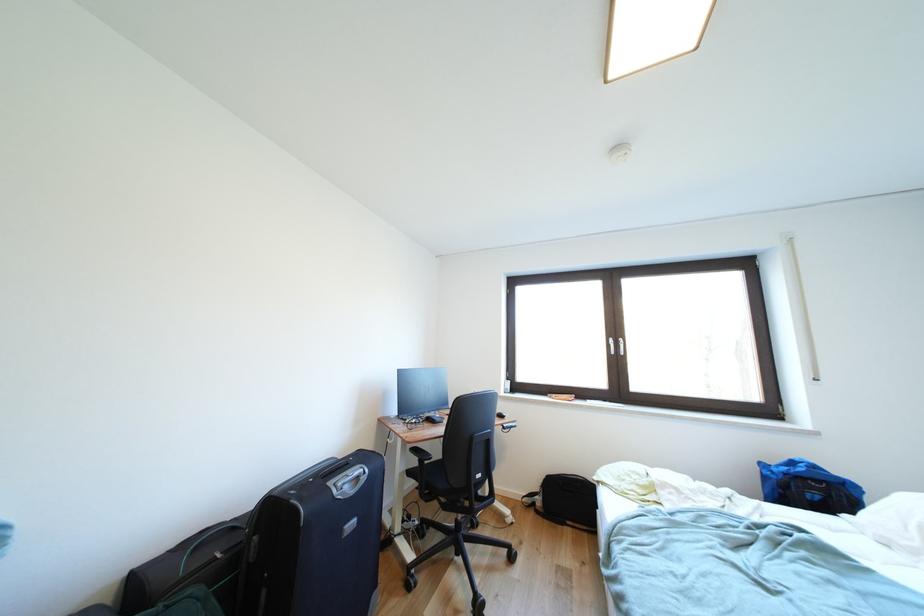
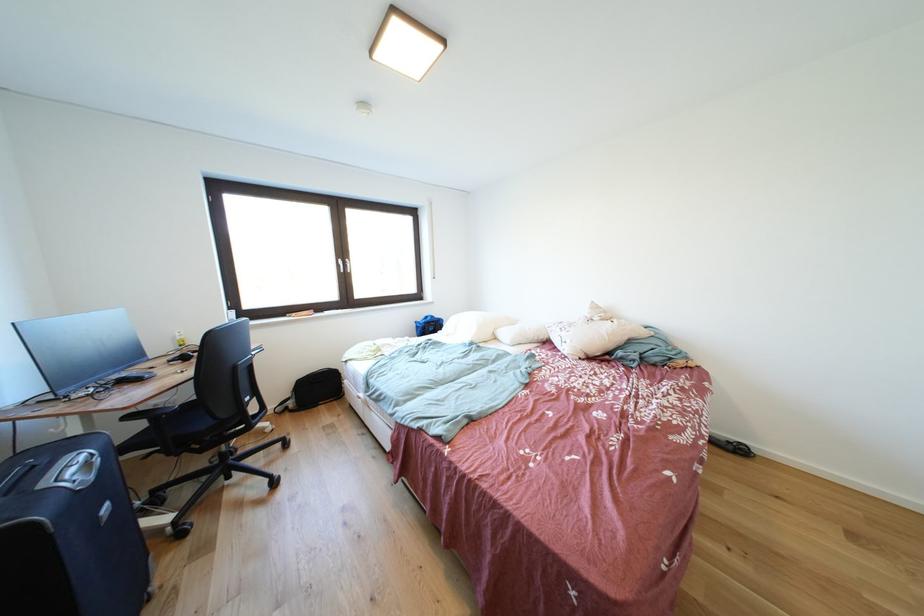
Locate, in the second image, the point that corresponds to [360,496] in the first image.

(101, 483)